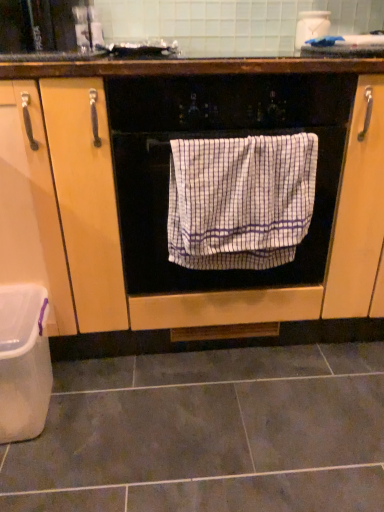
Question: Can you confirm if white checkered towel at center is bigger than gray matte tile at lower center?

Choices:
 (A) no
 (B) yes

Answer: (A)

Question: From a real-world perspective, is white checkered towel at center positioned under gray matte tile at lower center based on gravity?

Choices:
 (A) no
 (B) yes

Answer: (A)

Question: Is white checkered towel at center looking in the opposite direction of gray matte tile at lower center?

Choices:
 (A) yes
 (B) no

Answer: (B)

Question: Does white checkered towel at center have a greater height compared to gray matte tile at lower center?

Choices:
 (A) no
 (B) yes

Answer: (B)

Question: Is white checkered towel at center placed right next to gray matte tile at lower center?

Choices:
 (A) yes
 (B) no

Answer: (B)

Question: Considering the relative positions of white checkered towel at center and gray matte tile at lower center in the image provided, is white checkered towel at center to the right of gray matte tile at lower center from the viewer's perspective?

Choices:
 (A) yes
 (B) no

Answer: (A)

Question: Does white checkered towel at center have a lesser height compared to white checkered towel at center?

Choices:
 (A) no
 (B) yes

Answer: (A)

Question: Considering the relative sizes of white checkered towel at center and white checkered towel at center in the image provided, is white checkered towel at center wider than white checkered towel at center?

Choices:
 (A) yes
 (B) no

Answer: (A)

Question: Can you confirm if white checkered towel at center is positioned to the right of white checkered towel at center?

Choices:
 (A) yes
 (B) no

Answer: (B)

Question: Is white checkered towel at center inside white checkered towel at center?

Choices:
 (A) yes
 (B) no

Answer: (A)

Question: Considering the relative sizes of white checkered towel at center and white checkered towel at center in the image provided, is white checkered towel at center taller than white checkered towel at center?

Choices:
 (A) yes
 (B) no

Answer: (A)

Question: Considering the relative sizes of white checkered towel at center and white checkered towel at center in the image provided, is white checkered towel at center thinner than white checkered towel at center?

Choices:
 (A) yes
 (B) no

Answer: (B)

Question: From the image's perspective, does gray matte tile at lower center appear higher than white plastic container at lower left?

Choices:
 (A) no
 (B) yes

Answer: (A)